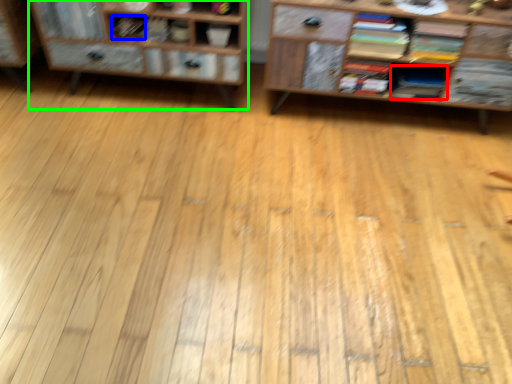
Question: Based on their relative distances, which object is nearer to book (highlighted by a red box)? Choose from book (highlighted by a blue box) and shelf (highlighted by a green box).

Choices:
 (A) book
 (B) shelf

Answer: (B)